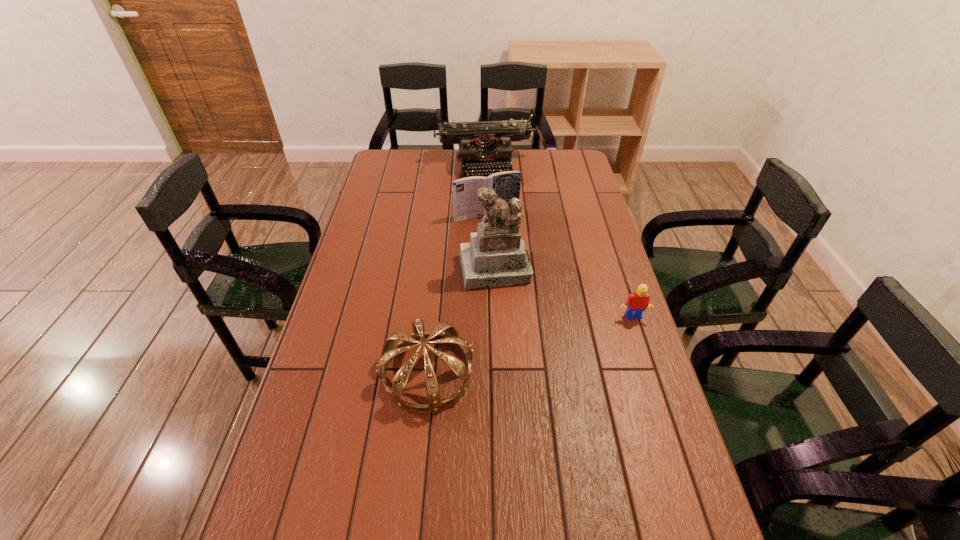
This screenshot has height=540, width=960. In order to click on blank space at the far edge of the desktop in this screenshot , I will do `click(415, 169)`.

This screenshot has width=960, height=540. What are the coordinates of `free region at the left edge of the desktop` in the screenshot? It's located at [373, 215].

This screenshot has width=960, height=540. In order to click on vacant space at the right edge of the desktop in this screenshot , I will do `click(587, 232)`.

The height and width of the screenshot is (540, 960). Identify the location of vacant space at the far left corner of the desktop. (404, 159).

You are a GUI agent. You are given a task and a screenshot of the screen. Output one action in this format:
    pyautogui.click(x=<x>, y=<y>)
    Task: Click on the vacant space at the far right corner of the desktop
    The height and width of the screenshot is (540, 960).
    Given the screenshot: What is the action you would take?
    pyautogui.click(x=569, y=152)

The image size is (960, 540). Identify the location of free spot between the farthest object and the nearest object. (457, 270).

The width and height of the screenshot is (960, 540). I want to click on free area in between the tallest object and the tiara, so click(x=462, y=321).

You are a GUI agent. You are given a task and a screenshot of the screen. Output one action in this format:
    pyautogui.click(x=<x>, y=<y>)
    Task: Click on the unoccupied area between the typewriter and the nearest object
    This screenshot has width=960, height=540.
    Given the screenshot: What is the action you would take?
    pyautogui.click(x=457, y=270)

Where is `unoccupied area between the second farthest object and the tiara`? This screenshot has height=540, width=960. unoccupied area between the second farthest object and the tiara is located at coordinates (457, 295).

Find the location of a particular element. free space that is in between the nearest object and the book is located at coordinates (457, 295).